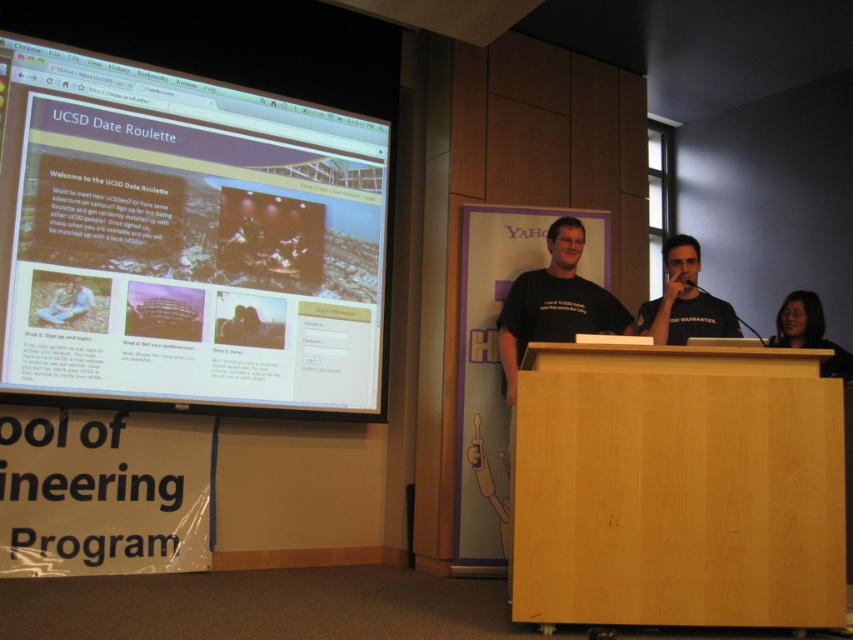
Question: Which object is the closest to the light wood podium at center?

Choices:
 (A) matte black hair at lower right
 (B) black matte shirt at center

Answer: (B)

Question: Does matte black screen at left appear on the left side of black matte shirt at center?

Choices:
 (A) yes
 (B) no

Answer: (A)

Question: Among these points, which one is nearest to the camera?

Choices:
 (A) (508, 326)
 (B) (694, 460)

Answer: (B)

Question: Is black matte shirt at center bigger than matte black hair at lower right?

Choices:
 (A) yes
 (B) no

Answer: (B)

Question: Does light wood podium at center have a lesser width compared to black matte shirt at center?

Choices:
 (A) yes
 (B) no

Answer: (B)

Question: Among these objects, which one is farthest from the camera?

Choices:
 (A) matte black screen at left
 (B) matte black hair at lower right
 (C) light wood podium at center
 (D) black matte t-shirt at center

Answer: (D)